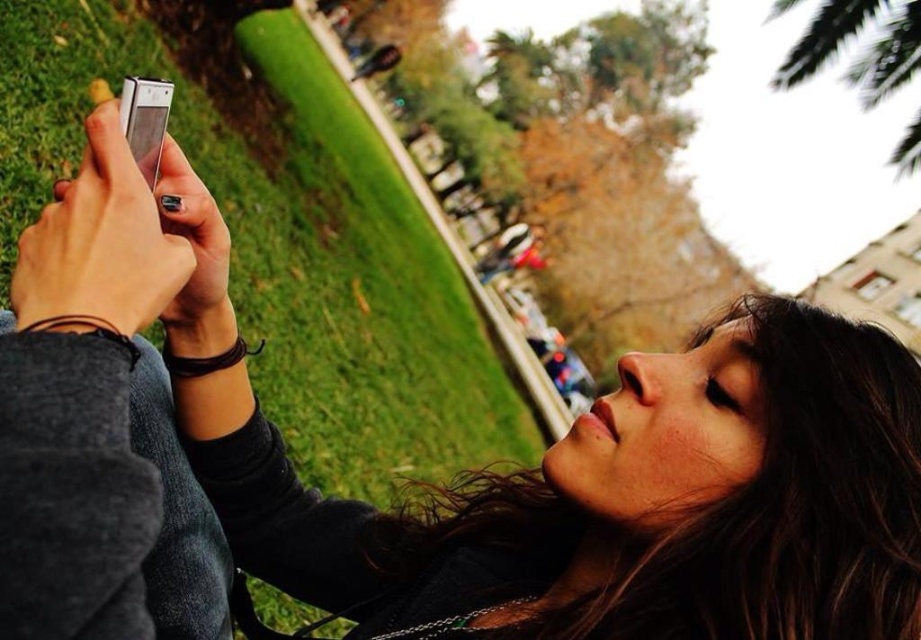
Question: Does dark brown hair at upper right have a lesser width compared to silver metallic smartphone at upper left?

Choices:
 (A) no
 (B) yes

Answer: (A)

Question: Which object is farther from the camera taking this photo?

Choices:
 (A) silver metallic smartphone at upper left
 (B) dark brown hair at upper right

Answer: (B)

Question: Is the position of dark brown hair at upper right more distant than that of silver metallic smartphone at upper left?

Choices:
 (A) no
 (B) yes

Answer: (B)

Question: Does dark brown hair at upper right appear on the left side of silver metallic smartphone at upper left?

Choices:
 (A) no
 (B) yes

Answer: (A)